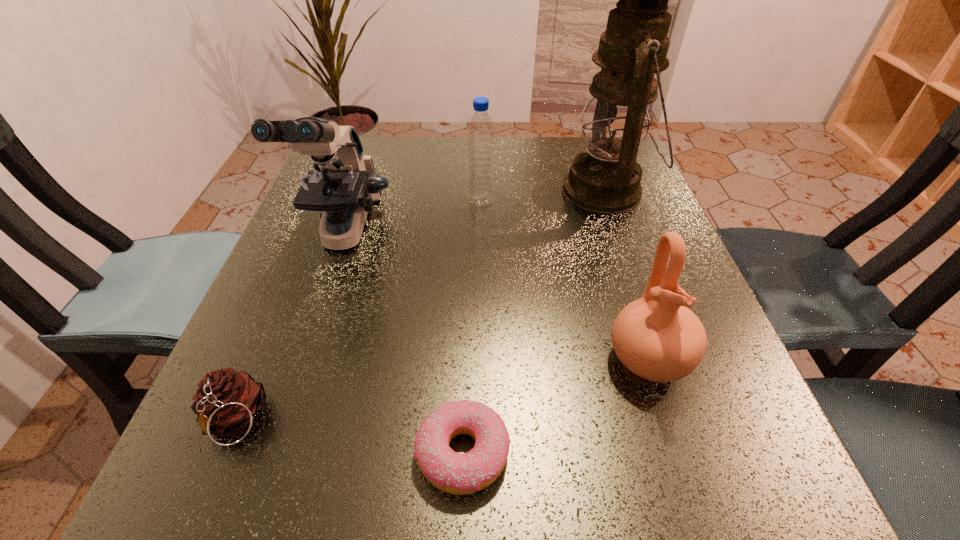
The width and height of the screenshot is (960, 540). What are the coordinates of `blank space located 0.100m on the back of the shortest object` in the screenshot? It's located at (466, 351).

At what (x,y) coordinates should I click in order to perform the action: click on object that is at the far edge. Please return your answer as a coordinate pair (x, y). This screenshot has height=540, width=960. Looking at the image, I should click on (605, 179).

Identify the location of pinecone that is at the near edge. (228, 403).

In order to click on doughnut that is at the near edge in this screenshot , I will do `click(456, 473)`.

At what (x,y) coordinates should I click in order to perform the action: click on microscope that is at the left edge. Please return your answer as a coordinate pair (x, y). Looking at the image, I should click on (345, 188).

This screenshot has height=540, width=960. Find the location of `pinecone that is at the left edge`. pinecone that is at the left edge is located at coordinates (228, 403).

The height and width of the screenshot is (540, 960). I want to click on oil lamp that is at the right edge, so click(605, 179).

I want to click on pottery at the right edge, so click(x=656, y=337).

At what (x,y) coordinates should I click in order to perform the action: click on object that is at the near left corner. Please return your answer as a coordinate pair (x, y). Looking at the image, I should click on (228, 403).

Image resolution: width=960 pixels, height=540 pixels. I want to click on object that is at the far right corner, so click(605, 179).